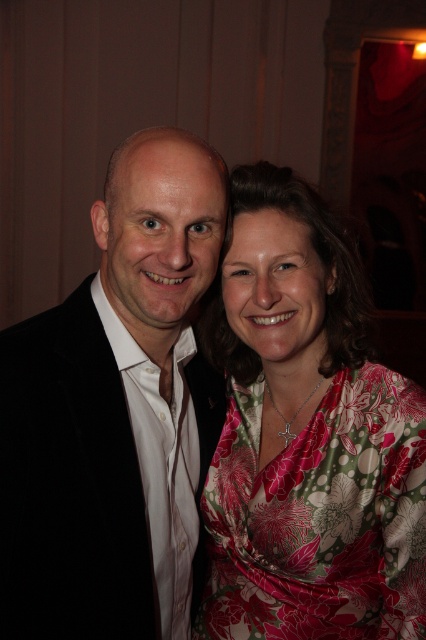
Question: Does black velvet suit at left appear on the right side of floral silk dress at center?

Choices:
 (A) no
 (B) yes

Answer: (A)

Question: Can you confirm if black velvet suit at left is wider than floral silk dress at center?

Choices:
 (A) yes
 (B) no

Answer: (B)

Question: Is black velvet suit at left below floral silk dress at center?

Choices:
 (A) no
 (B) yes

Answer: (A)

Question: Which of the following is the closest to the observer?

Choices:
 (A) floral silk dress at center
 (B) black velvet suit at left

Answer: (B)